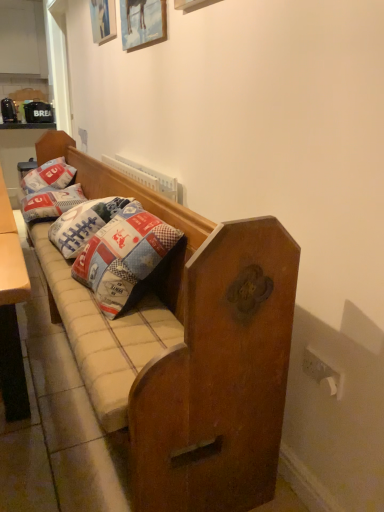
Question: From the image's perspective, does patchwork fabric pillow at left, arranged as the 1th pillow when viewed from the front, appear lower than wooden picture frame at upper center, the 1th picture frame in the right-to-left sequence?

Choices:
 (A) yes
 (B) no

Answer: (A)

Question: Is the position of patchwork fabric pillow at left, placed as the 2th pillow when sorted from back to front, less distant than that of wooden picture frame at upper center, the 1th picture frame from the bottom?

Choices:
 (A) yes
 (B) no

Answer: (B)

Question: Would you consider patchwork fabric pillow at left, arranged as the 1th pillow when viewed from the front, to be distant from wooden picture frame at upper center, the 1th picture frame from the bottom?

Choices:
 (A) yes
 (B) no

Answer: (A)

Question: Is patchwork fabric pillow at left, placed as the 2th pillow when sorted from back to front, completely or partially outside of wooden picture frame at upper center, the 1th picture frame in the right-to-left sequence?

Choices:
 (A) no
 (B) yes

Answer: (B)

Question: Can you confirm if patchwork fabric pillow at left, arranged as the 1th pillow when viewed from the front, is wider than wooden picture frame at upper center, the 1th picture frame in the right-to-left sequence?

Choices:
 (A) no
 (B) yes

Answer: (B)

Question: Would you say wooden picture frame at upper center, the 1th picture frame in the right-to-left sequence, is part of patchwork fabric pillow at left, arranged as the 1th pillow when viewed from the front,'s contents?

Choices:
 (A) yes
 (B) no

Answer: (B)

Question: Is wooden picture frame at upper center, the 1th picture frame from the bottom, positioned with its back to patchwork fabric pillow at left, placed as the 2th pillow when sorted from back to front?

Choices:
 (A) no
 (B) yes

Answer: (A)

Question: Could patchwork fabric pillow at left, placed as the 2th pillow when sorted from back to front, be considered to be inside wooden picture frame at upper center, the 1th picture frame from the bottom?

Choices:
 (A) no
 (B) yes

Answer: (A)

Question: Considering the relative positions of wooden picture frame at upper center, the 1th picture frame in the right-to-left sequence, and patchwork fabric pillow at left, placed as the 2th pillow when sorted from back to front, in the image provided, is wooden picture frame at upper center, the 1th picture frame in the right-to-left sequence, to the right of patchwork fabric pillow at left, placed as the 2th pillow when sorted from back to front, from the viewer's perspective?

Choices:
 (A) no
 (B) yes

Answer: (B)

Question: Considering the relative sizes of wooden picture frame at upper center, the 2th picture frame from the back, and patchwork fabric pillow at left, arranged as the 1th pillow when viewed from the front, in the image provided, is wooden picture frame at upper center, the 2th picture frame from the back, taller than patchwork fabric pillow at left, arranged as the 1th pillow when viewed from the front,?

Choices:
 (A) yes
 (B) no

Answer: (A)

Question: Is wooden picture frame at upper center, marked as the second picture frame in a left-to-right arrangement, smaller than patchwork fabric pillow at left, placed as the 2th pillow when sorted from back to front?

Choices:
 (A) no
 (B) yes

Answer: (B)

Question: From a real-world perspective, is wooden picture frame at upper center, the 1th picture frame from the bottom, physically above patchwork fabric pillow at left, placed as the 2th pillow when sorted from back to front?

Choices:
 (A) yes
 (B) no

Answer: (A)

Question: Can you confirm if wooden picture frame at upper center, marked as the first picture frame in a top-to-bottom arrangement, is thinner than wooden studio couch at center?

Choices:
 (A) no
 (B) yes

Answer: (B)